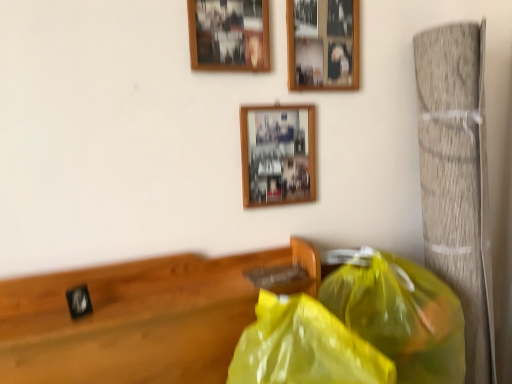
The height and width of the screenshot is (384, 512). In order to click on blank space situated above black matte clock at left (from a real-world perspective) in this screenshot , I will do `click(177, 292)`.